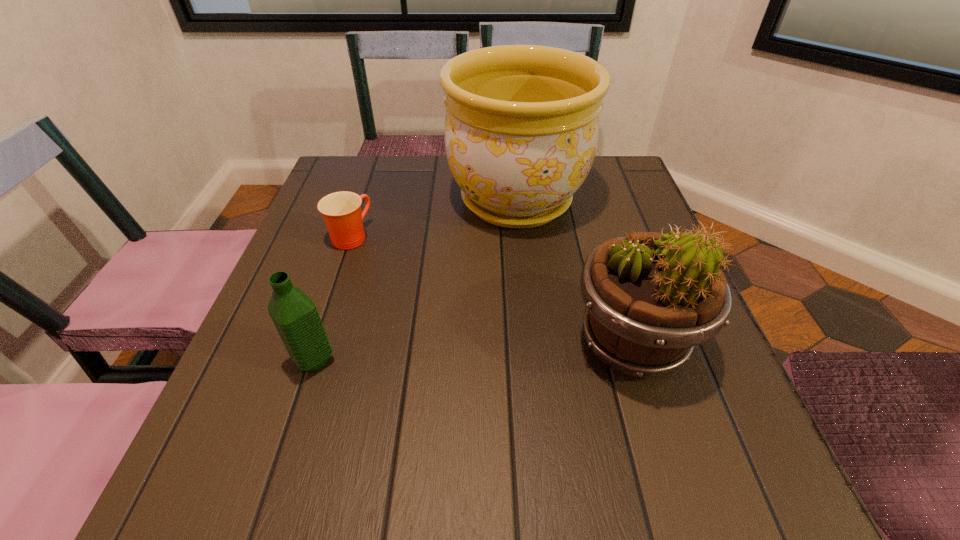
You are a GUI agent. You are given a task and a screenshot of the screen. Output one action in this format:
    pyautogui.click(x=<x>, y=<y>)
    Task: Click on the blank region between the cup and the third tallest object
    
    Given the screenshot: What is the action you would take?
    pyautogui.click(x=332, y=298)

Where is `free space between the nearer flowerpot and the farther flowerpot`? The height and width of the screenshot is (540, 960). free space between the nearer flowerpot and the farther flowerpot is located at coordinates (574, 272).

Image resolution: width=960 pixels, height=540 pixels. Identify the location of vacant region between the shortest object and the farther flowerpot. (433, 218).

Locate an element on the screen. free space that is in between the cup and the water bottle is located at coordinates (332, 298).

In order to click on unoccupied position between the third tallest object and the cup in this screenshot , I will do `click(332, 298)`.

Find the location of `free space between the nearer flowerpot and the farther flowerpot`. free space between the nearer flowerpot and the farther flowerpot is located at coordinates (574, 272).

At what (x,y) coordinates should I click in order to perform the action: click on free space between the water bottle and the farther flowerpot. Please return your answer as a coordinate pair (x, y). The height and width of the screenshot is (540, 960). Looking at the image, I should click on pyautogui.click(x=415, y=280).

Identify which object is the second closest to the cup. Please provide its 2D coordinates. Your answer should be formatted as a tuple, i.e. [(x, y)], where the tuple contains the x and y coordinates of a point satisfying the conditions above.

[(294, 314)]

Where is `object that is the closest to the third tallest object`? object that is the closest to the third tallest object is located at coordinates (341, 211).

Image resolution: width=960 pixels, height=540 pixels. I want to click on vacant space that satisfies the following two spatial constraints: 1. on the back side of the second shortest object; 2. on the right side of the farther flowerpot, so click(x=366, y=200).